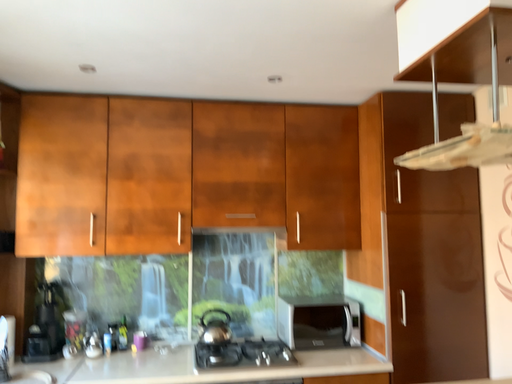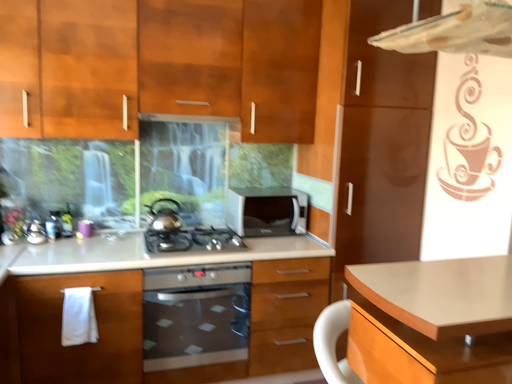
Question: Which way did the camera rotate in the video?

Choices:
 (A) rotated right
 (B) rotated left

Answer: (A)